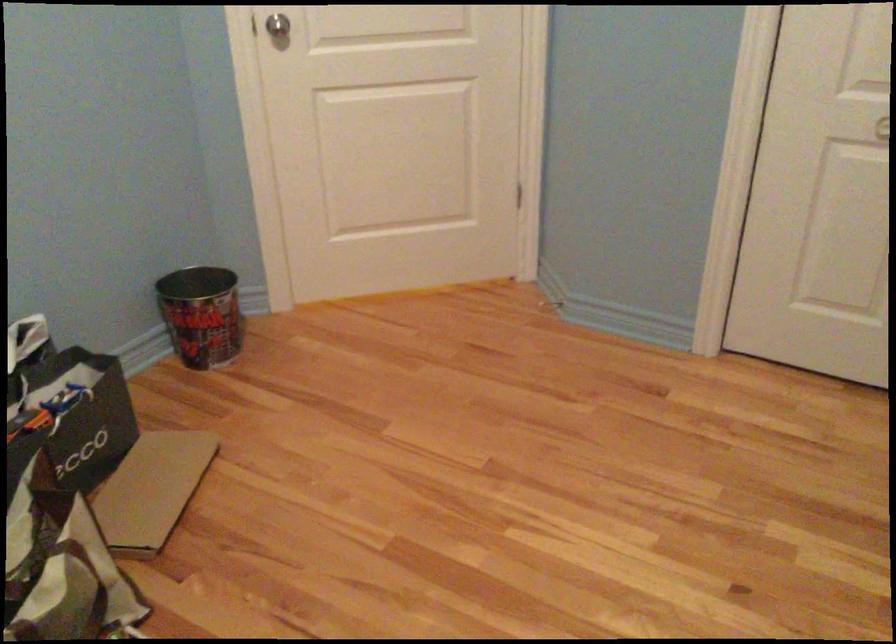
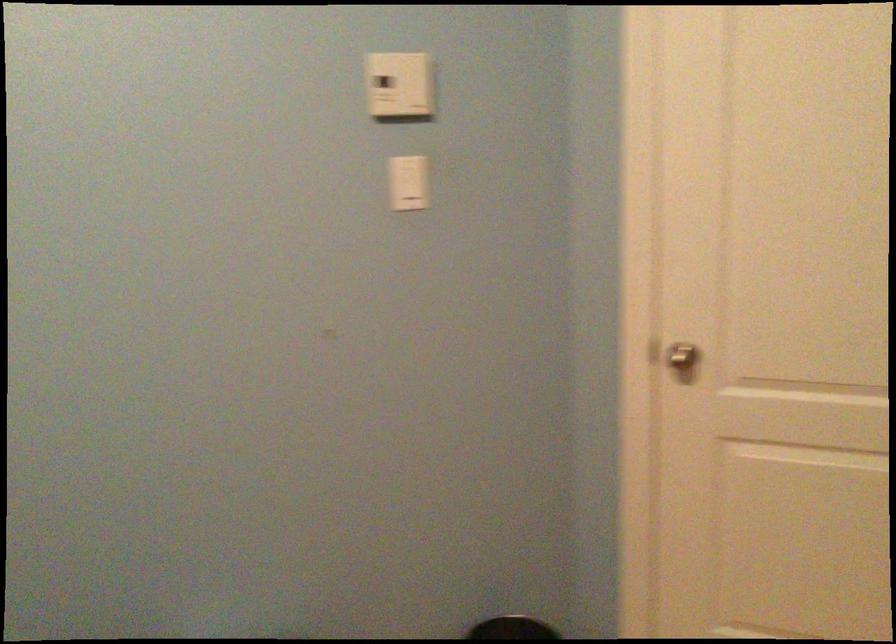
Question: The camera is either moving clockwise (left) or counter-clockwise (right) around the object. The first image is from the beginning of the video and the second image is from the end. Is the camera moving left or right when shooting the video?

Choices:
 (A) Left
 (B) Right

Answer: (B)